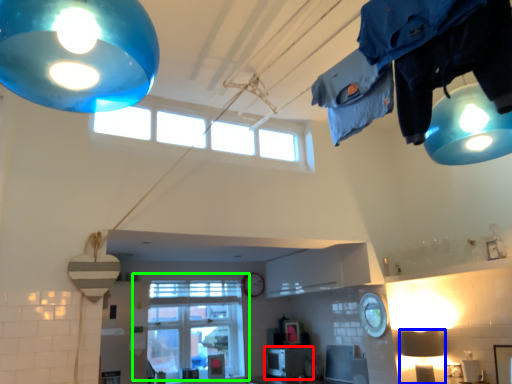
Question: Which object is the farthest from appliance (highlighted by a red box)? Choose among these: lamp (highlighted by a blue box) or window (highlighted by a green box).

Choices:
 (A) lamp
 (B) window

Answer: (A)